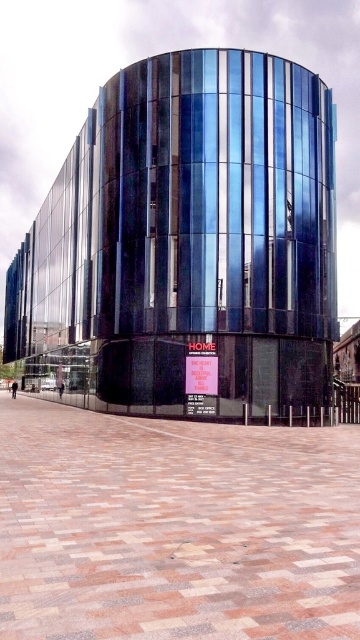
Is polished concrete plaza at center below red plastic sign at center?

Actually, polished concrete plaza at center is above red plastic sign at center.

Is polished concrete plaza at center bigger than red plastic sign at center?

Yes, polished concrete plaza at center is bigger than red plastic sign at center.

From the picture: Measure the distance between point (165, 307) and camera.

Point (165, 307) is 25.77 meters away from camera.

Where is `polished concrete plaza at center`? polished concrete plaza at center is located at coordinates (186, 243).

From the picture: Can you confirm if polished concrete plaza at center is bigger than paved brick plaza at center?

Yes.

Between polished concrete plaza at center and paved brick plaza at center, which one appears on the left side from the viewer's perspective?

Positioned to the left is polished concrete plaza at center.

Is point (138, 67) in front of point (249, 426)?

No.

The width and height of the screenshot is (360, 640). I want to click on polished concrete plaza at center, so click(x=186, y=243).

Does paved brick plaza at center appear on the right side of red plastic sign at center?

Incorrect, paved brick plaza at center is not on the right side of red plastic sign at center.

Is point (174, 428) farther from camera compared to point (217, 394)?

No, (174, 428) is in front of (217, 394).

Image resolution: width=360 pixels, height=640 pixels. What do you see at coordinates (174, 528) in the screenshot? I see `paved brick plaza at center` at bounding box center [174, 528].

Identify the location of paved brick plaza at center. (174, 528).